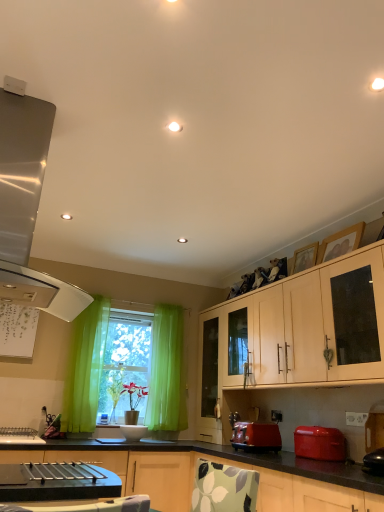
Question: Is matte white cabinet at center, placed as the 2th cabinetry when sorted from top to bottom, in front of or behind satin metallic range hood at left in the image?

Choices:
 (A) behind
 (B) front

Answer: (A)

Question: Is matte white cabinet at center, placed as the 2th cabinetry when sorted from top to bottom, bigger or smaller than satin metallic range hood at left?

Choices:
 (A) small
 (B) big

Answer: (B)

Question: Which object is the farthest from the white plastic power outlet at lower right?

Choices:
 (A) wooden picture frame at upper right, the 1th picture frame positioned from the front
 (B) matte red toaster at lower right
 (C) white matte cabinet at upper right, which is the first cabinetry in top-to-bottom order
 (D) satin metallic range hood at left
 (E) wooden picture frame at upper right, the second picture frame when ordered from front to back

Answer: (D)

Question: Estimate the real-world distances between objects in this image. Which object is closer to the wooden picture frame at upper right, which is the 1th picture frame from back to front?

Choices:
 (A) satin metallic range hood at left
 (B) wooden picture frame at upper right, the second picture frame when ordered from back to front
 (C) white matte cabinet at upper right, which is the first cabinetry in top-to-bottom order
 (D) matte white cabinet at center, which ranks as the first cabinetry in bottom-to-top order
 (E) matte red toaster at lower right

Answer: (B)